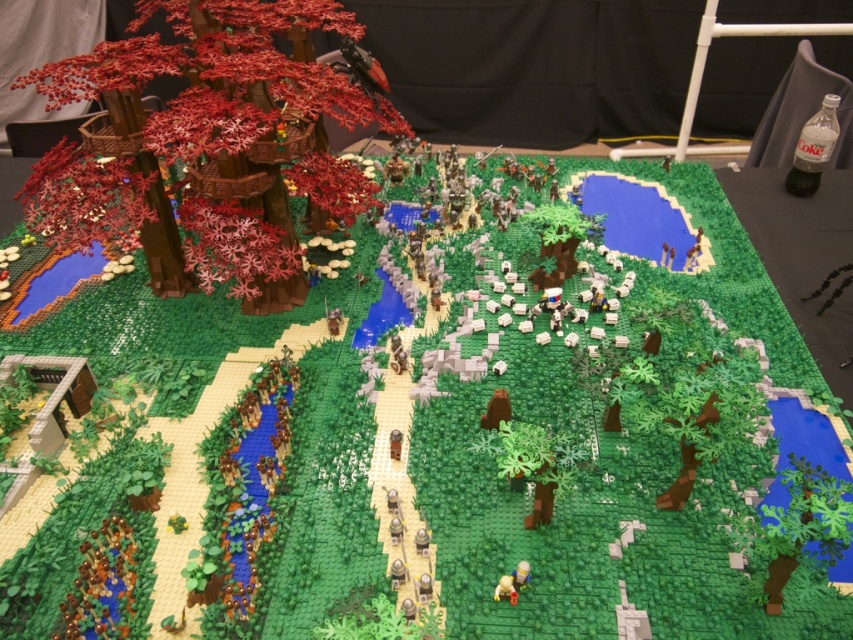
Question: Which object is closer to the camera taking this photo?

Choices:
 (A) green matte tree at center
 (B) brick-red leaves at left

Answer: (A)

Question: Does brick-red leaves at left have a greater width compared to green matte tree at center?

Choices:
 (A) no
 (B) yes

Answer: (B)

Question: Which of the following is the farthest from the observer?

Choices:
 (A) (834, 488)
 (B) (561, 435)

Answer: (B)

Question: Is brick-red leaves at left wider than green matte tree at lower right?

Choices:
 (A) yes
 (B) no

Answer: (A)

Question: Among these points, which one is nearest to the camera?

Choices:
 (A) (350, 186)
 (B) (502, 460)
 (C) (770, 525)

Answer: (C)

Question: Is brick-red leaves at left behind green matte tree at lower right?

Choices:
 (A) no
 (B) yes

Answer: (B)